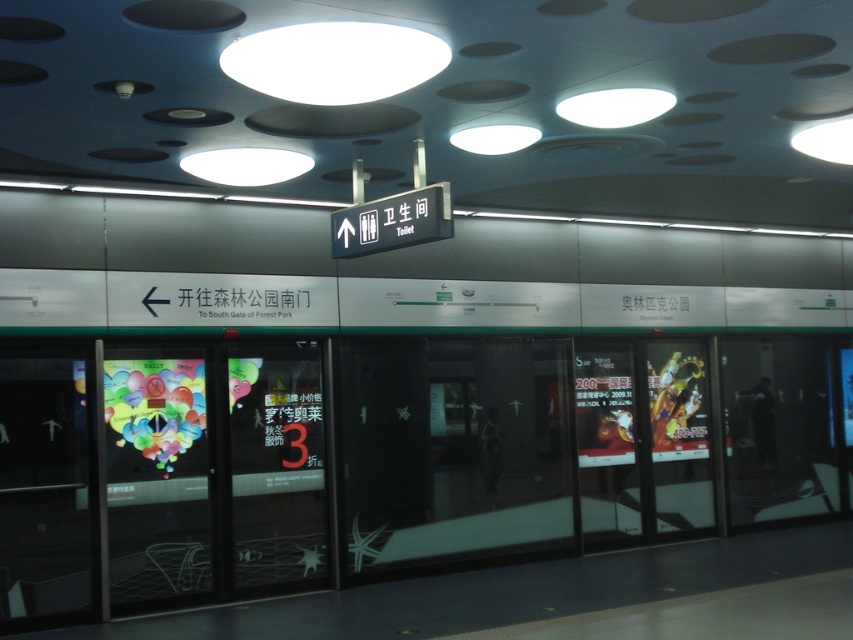
Question: Is transparent glass door at center positioned at the back of translucent glass door at center?

Choices:
 (A) yes
 (B) no

Answer: (B)

Question: Is transparent glass door at center in front of translucent glass door at center?

Choices:
 (A) yes
 (B) no

Answer: (A)

Question: Which point is closer to the camera?

Choices:
 (A) translucent glass door at center
 (B) transparent glass door at center

Answer: (B)

Question: Which object appears farthest from the camera in this image?

Choices:
 (A) translucent glass door at center
 (B) transparent glass door at center

Answer: (A)

Question: Which of the following is the closest to the observer?

Choices:
 (A) translucent glass door at center
 (B) transparent glass door at center

Answer: (B)

Question: Is transparent glass door at center in front of translucent glass door at center?

Choices:
 (A) no
 (B) yes

Answer: (B)